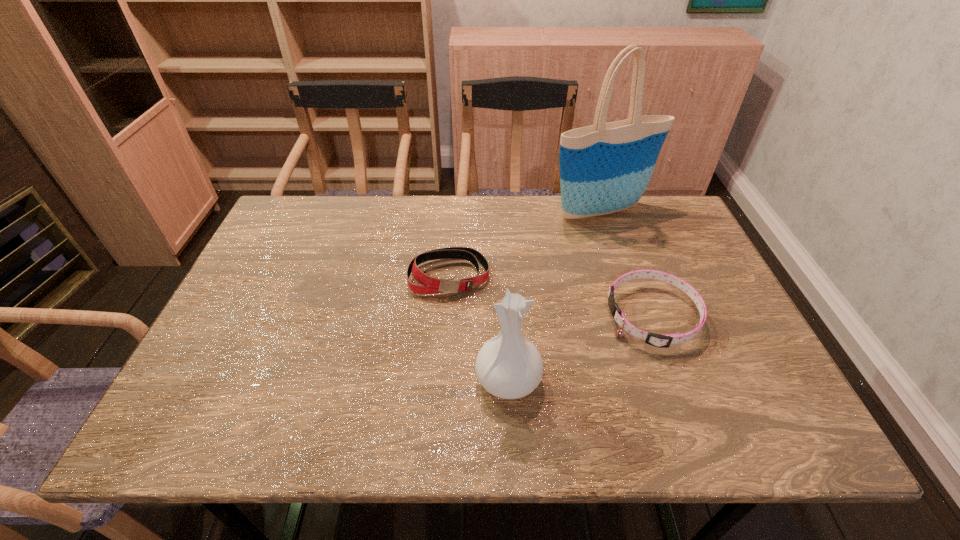
You are a GUI agent. You are given a task and a screenshot of the screen. Output one action in this format:
    pyautogui.click(x=<x>, y=<y>)
    Task: Click on the vacant region between the right dog collar and the left dog collar
    This screenshot has width=960, height=540.
    Given the screenshot: What is the action you would take?
    pyautogui.click(x=551, y=296)

At what (x,y) coordinates should I click in order to perform the action: click on free space that is in between the left dog collar and the vase. Please return your answer as a coordinate pair (x, y). Looking at the image, I should click on (479, 327).

You are a GUI agent. You are given a task and a screenshot of the screen. Output one action in this format:
    pyautogui.click(x=<x>, y=<y>)
    Task: Click on the object identified as the third closest to the vase
    This screenshot has height=540, width=960.
    Given the screenshot: What is the action you would take?
    pyautogui.click(x=605, y=168)

Identify the location of object that ranks as the second closest to the shorter dog collar. (605, 168).

I want to click on free space that satisfies the following two spatial constraints: 1. on the back side of the left dog collar; 2. on the right side of the tote bag, so click(x=454, y=212).